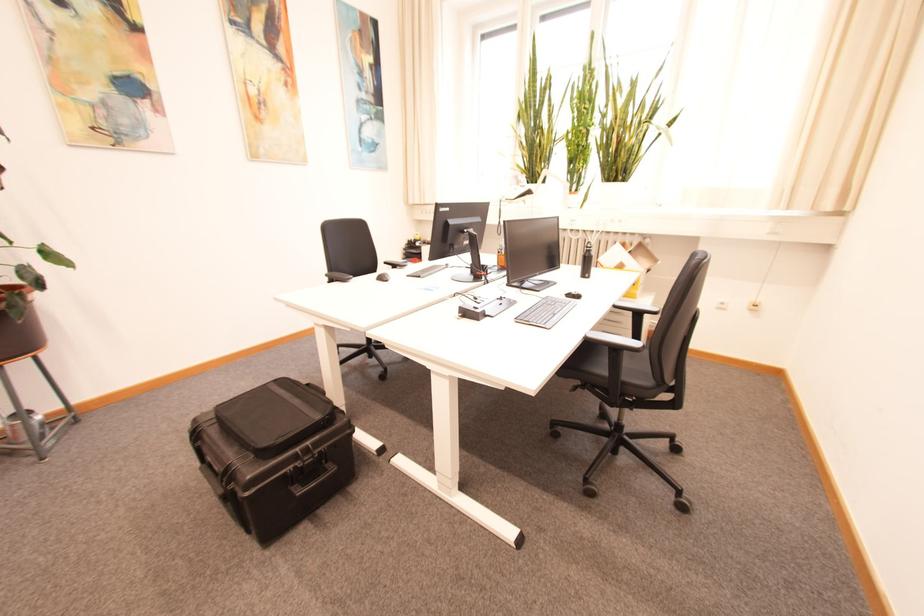
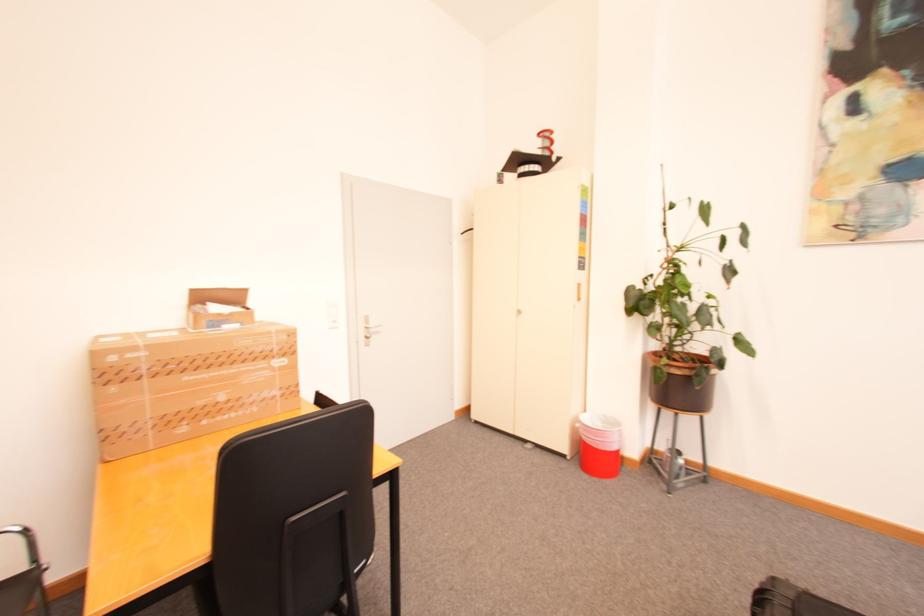
Question: The images are taken continuously from a first-person perspective. In which direction is your viewpoint rotating?

Choices:
 (A) Left
 (B) Right
 (C) Up
 (D) Down

Answer: (A)